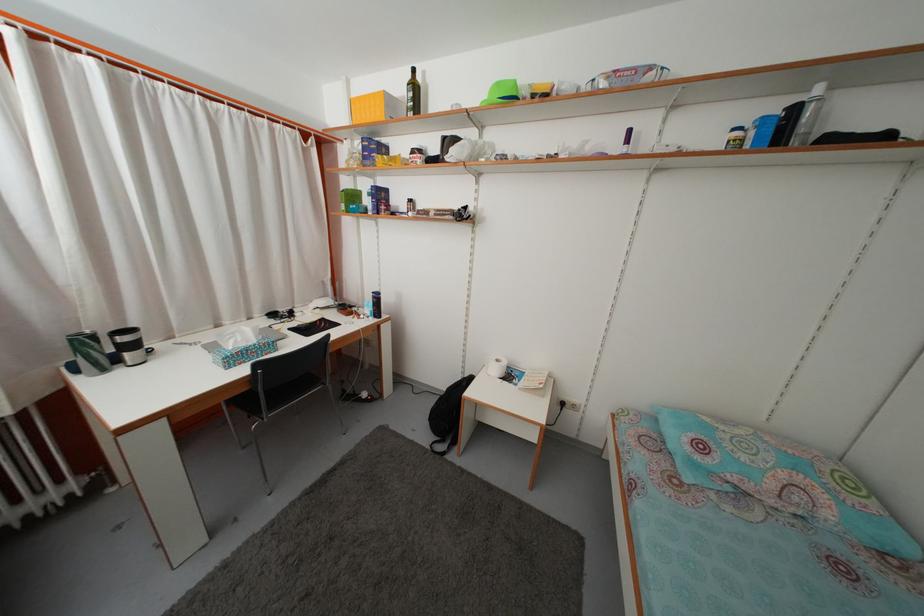
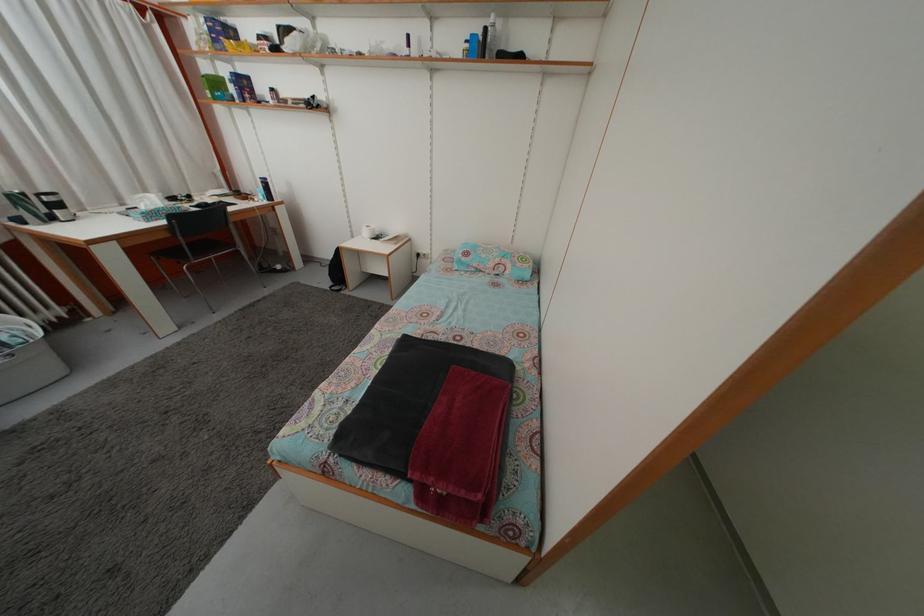
Question: I am providing you with two images of the same scene from different viewpoints. Which of the following objects are not visible in image2?

Choices:
 (A) clear plastic bottle
 (B) white spray bottle
 (C) patterned pillow
 (D) none of these

Answer: (D)